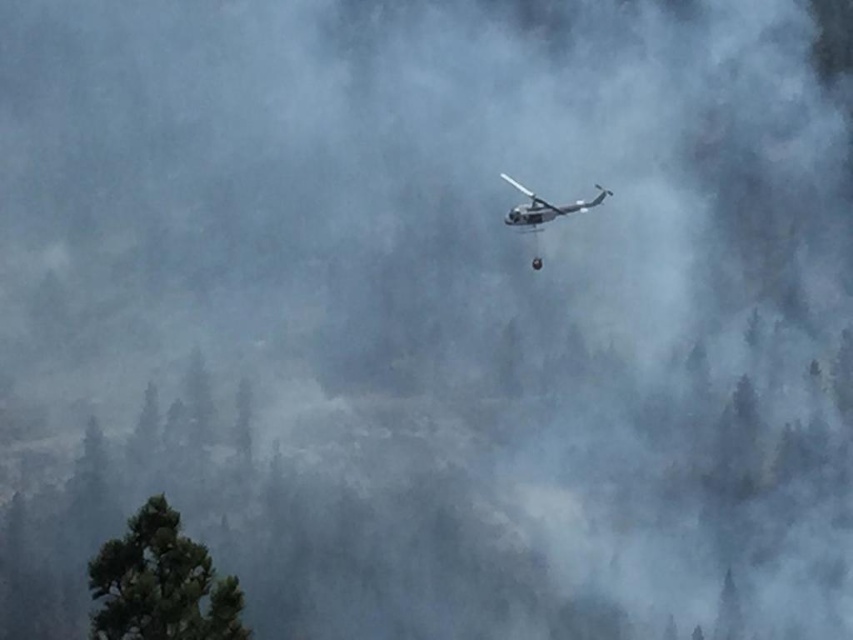
Which is more to the left, green textured tree at lower left or metallic gray helicopter at center?

green textured tree at lower left

Does green textured tree at lower left have a smaller size compared to metallic gray helicopter at center?

Yes.

Between point (155, 509) and point (526, 212), which one is positioned in front?

Positioned in front is point (155, 509).

Locate an element on the screen. green textured tree at lower left is located at coordinates (161, 582).